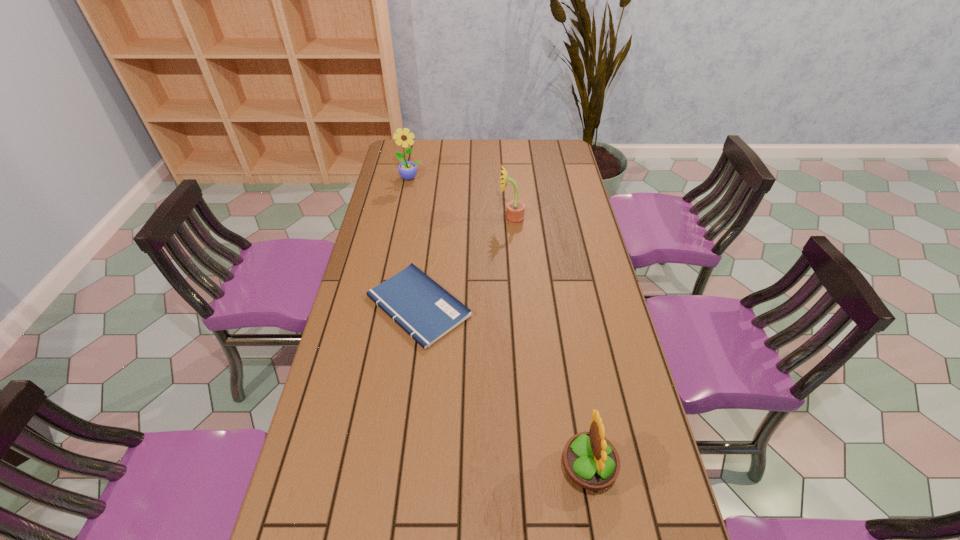
Image resolution: width=960 pixels, height=540 pixels. In order to click on free region located 0.150m on the face of the second sunflower from left to right in this screenshot , I will do `click(460, 219)`.

The height and width of the screenshot is (540, 960). Find the location of `free region located 0.100m on the face of the second sunflower from left to right`. free region located 0.100m on the face of the second sunflower from left to right is located at coordinates (472, 219).

Find the location of a particular element. Image resolution: width=960 pixels, height=540 pixels. vacant space situated on the face of the nearest object is located at coordinates (454, 468).

Locate an element on the screen. This screenshot has height=540, width=960. free space located 0.170m on the face of the nearest object is located at coordinates (489, 468).

Find the location of a particular element. The width and height of the screenshot is (960, 540). free space located 0.170m on the face of the nearest object is located at coordinates (489, 468).

In order to click on vacant space positioned on the front of the third farthest object in this screenshot , I will do `click(411, 365)`.

Where is `sunflower located at the left edge`? The width and height of the screenshot is (960, 540). sunflower located at the left edge is located at coordinates (407, 169).

Image resolution: width=960 pixels, height=540 pixels. What are the coordinates of `paperback book at the left edge` in the screenshot? It's located at (426, 311).

Find the location of a particular element. This screenshot has width=960, height=540. object that is at the right edge is located at coordinates (592, 462).

Where is `free space at the far edge of the desktop`? free space at the far edge of the desktop is located at coordinates (470, 153).